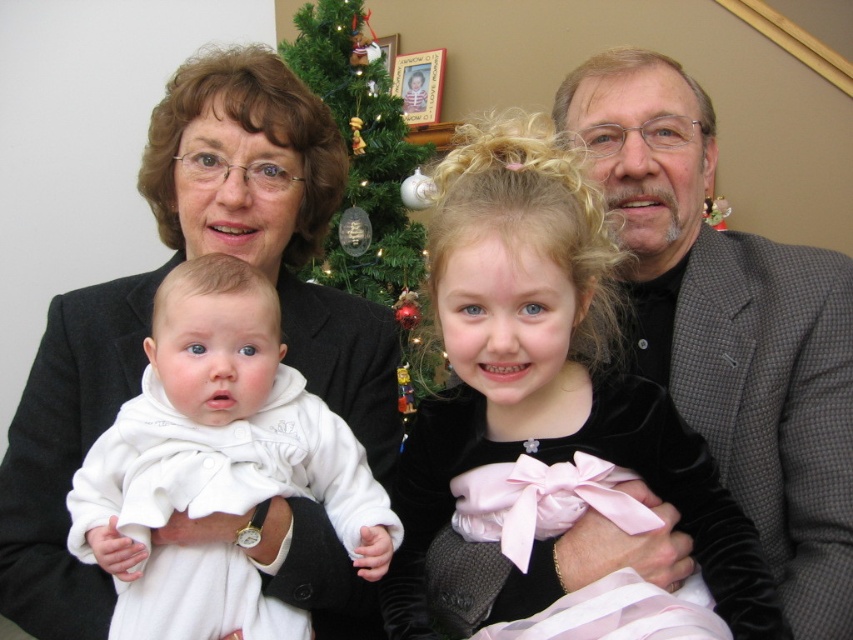
Is point (477, 376) more distant than point (384, 170)?

No.

Between velvet black dress at center and green matte christmas tree at center, which one has more height?

green matte christmas tree at center is taller.

Does point (598, 218) come in front of point (376, 77)?

Yes, it is.

At what (x,y) coordinates should I click in order to perform the action: click on velvet black dress at center. Please return your answer as a coordinate pair (x, y). This screenshot has width=853, height=640. Looking at the image, I should click on (547, 369).

From the picture: Which is above, velvet black dress at center or white satin baby at center?

Positioned higher is velvet black dress at center.

Which is more to the left, velvet black dress at center or white satin baby at center?

white satin baby at center is more to the left.

Is point (611, 396) farther from camera compared to point (231, 310)?

That is False.

In order to click on velvet black dress at center in this screenshot , I will do `click(547, 369)`.

Can you confirm if gray textured suit at right is positioned below green matte christmas tree at center?

Yes.

Based on the photo, is gray textured suit at right further to camera compared to green matte christmas tree at center?

No, it is in front of green matte christmas tree at center.

Who is more forward, (819,324) or (328,273)?

Positioned in front is point (819,324).

Identify the location of gray textured suit at right. (729, 324).